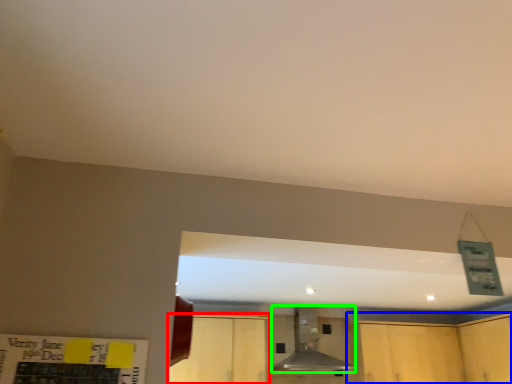
Question: Considering the real-world distances, which object is farthest from cabinetry (highlighted by a red box)? cabinetry (highlighted by a blue box) or vent (highlighted by a green box)?

Choices:
 (A) cabinetry
 (B) vent

Answer: (A)